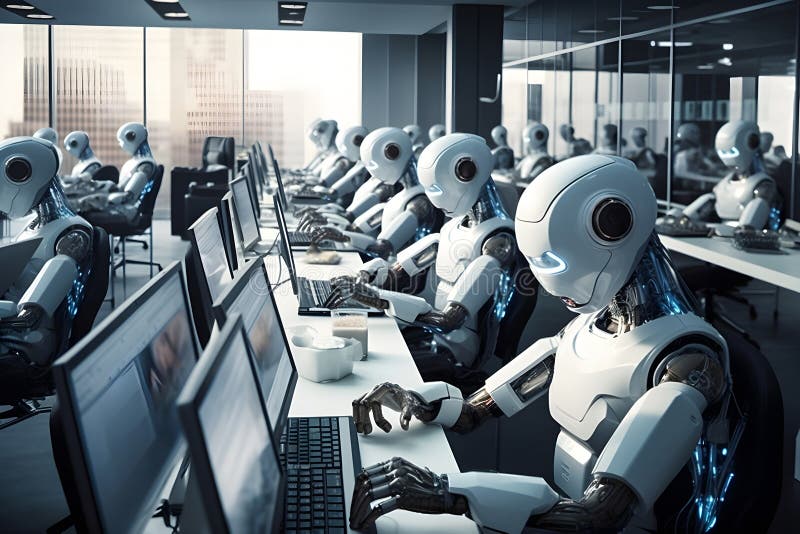
At what (x,y) coordinates should I click in order to perform the action: click on windows. Please return your answer as a coordinate pair (x, y). The width and height of the screenshot is (800, 534). Looking at the image, I should click on tap(33, 78), tap(110, 78), tap(188, 78), tap(310, 93).